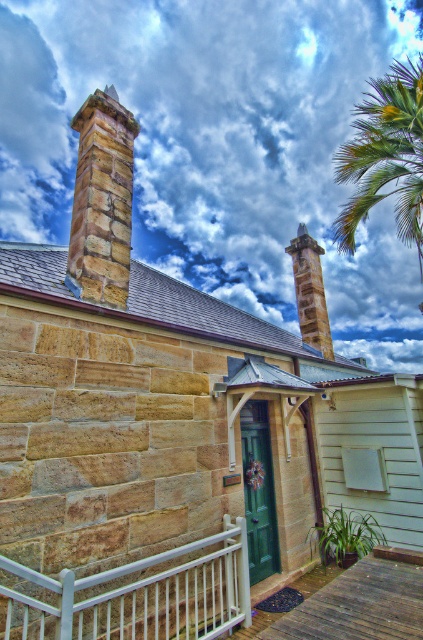
You are a drone operator planning to fly a drone between the white fluffy cloud at upper center and the brown stone chimney at upper left. The drone has a maximum flight range of 100 feet. Can the drone safely complete this task without exceeding its range?

→ The distance between the white fluffy cloud at upper center and the brown stone chimney at upper left is 86.58 feet, which is within the drone operator s 100 feet maximum range. Therefore, the drone can safely complete the task without exceeding its range.

You are standing in front of the historic stone building and want to walk from point A to point B. If point A is at coordinates point [85,620] and point B is at point [106,276], which direction should you move to go from point A to point B?

To go from point A at [85,620] to point B at [106,276], you should move towards the left and slightly forward since point A is in front of point B.

You are an architect designing a new building and want to ensure that the white fluffy cloud at upper center does not block the view from the entrance. Given that the entrance is at the center of the building, which direction should the entrance face to avoid the cloud?

The entrance should face away from the white fluffy cloud at upper center, which is located at point 0.227 on the x and 0.518 on the y axis. Since the entrance is at the center, facing away from the cloud would mean orienting it towards the opposite direction of the cloud.